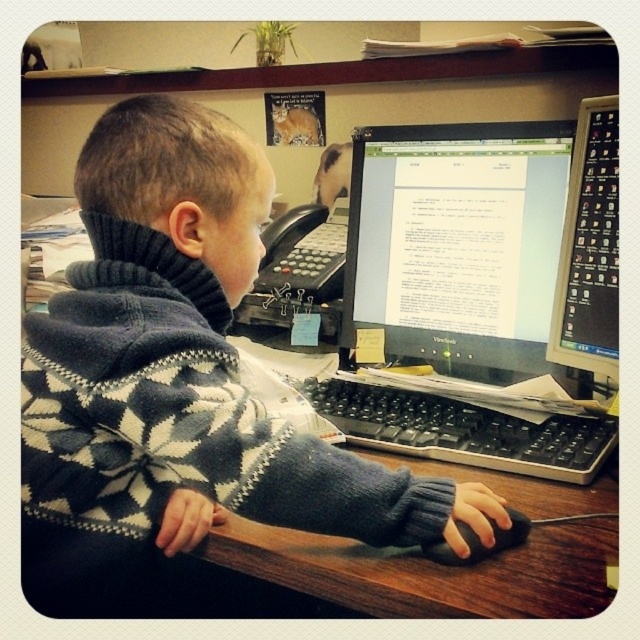
Question: Is dark blue sweater at center smaller than matte black monitor at right?

Choices:
 (A) no
 (B) yes

Answer: (A)

Question: Among these objects, which one is farthest from the camera?

Choices:
 (A) black plastic keyboard at center
 (B) dark blue sweater at center

Answer: (A)

Question: Can you confirm if black glossy monitor at center is thinner than matte black monitor at right?

Choices:
 (A) yes
 (B) no

Answer: (B)

Question: Is matte black monitor at right below black matte mouse at center?

Choices:
 (A) no
 (B) yes

Answer: (A)

Question: Among these objects, which one is farthest from the camera?

Choices:
 (A) dark blue sweater at center
 (B) black plastic keyboard at center
 (C) matte black monitor at right
 (D) black glossy monitor at center

Answer: (C)

Question: Which point is closer to the camera?

Choices:
 (A) matte black monitor at right
 (B) black plastic keyboard at center
 (C) dark blue sweater at center
 (D) black glossy monitor at center

Answer: (C)